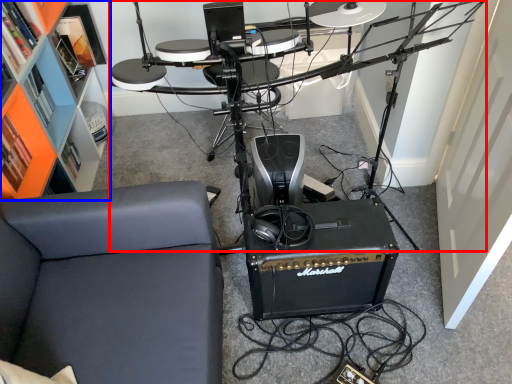
Question: Among these objects, which one is nearest to the camera, computer desk (highlighted by a red box) or bookshelf (highlighted by a blue box)?

Choices:
 (A) computer desk
 (B) bookshelf

Answer: (A)